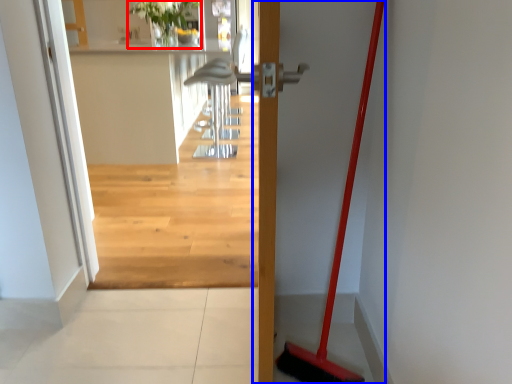
Question: Among these objects, which one is farthest to the camera, plant (highlighted by a red box) or door (highlighted by a blue box)?

Choices:
 (A) plant
 (B) door

Answer: (A)